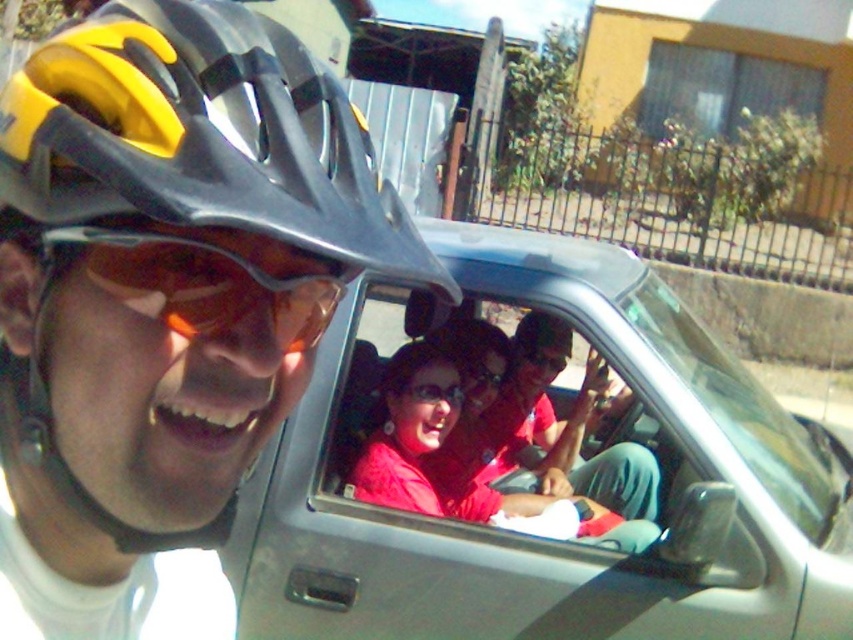
In the scene shown: Does matte black helmet at left have a greater width compared to matte black goggles at center?

Correct, the width of matte black helmet at left exceeds that of matte black goggles at center.

The image size is (853, 640). What do you see at coordinates (202, 134) in the screenshot?
I see `matte black helmet at left` at bounding box center [202, 134].

Identify the location of matte black helmet at left. (202, 134).

Between silver metallic car at center and matte black helmet at left, which one has more height?

silver metallic car at center

Can you confirm if silver metallic car at center is smaller than matte black helmet at left?

Actually, silver metallic car at center might be larger than matte black helmet at left.

I want to click on silver metallic car at center, so click(x=537, y=477).

Can you confirm if silver metallic car at center is positioned to the left of matte black goggles at center?

No, silver metallic car at center is not to the left of matte black goggles at center.

Can you confirm if silver metallic car at center is wider than matte black goggles at center?

Yes, silver metallic car at center is wider than matte black goggles at center.

Is point (660, 605) behind point (306, 330)?

Yes, point (660, 605) is behind point (306, 330).

I want to click on silver metallic car at center, so click(x=537, y=477).